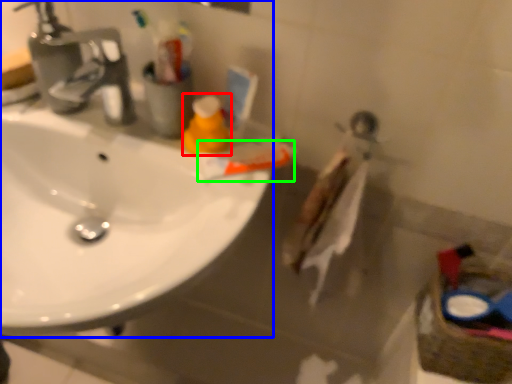
Question: Estimate the real-world distances between objects in this image. Which object is closer to cleaning product (highlighted by a red box), sink (highlighted by a blue box) or toothpaste (highlighted by a green box)?

Choices:
 (A) sink
 (B) toothpaste

Answer: (B)